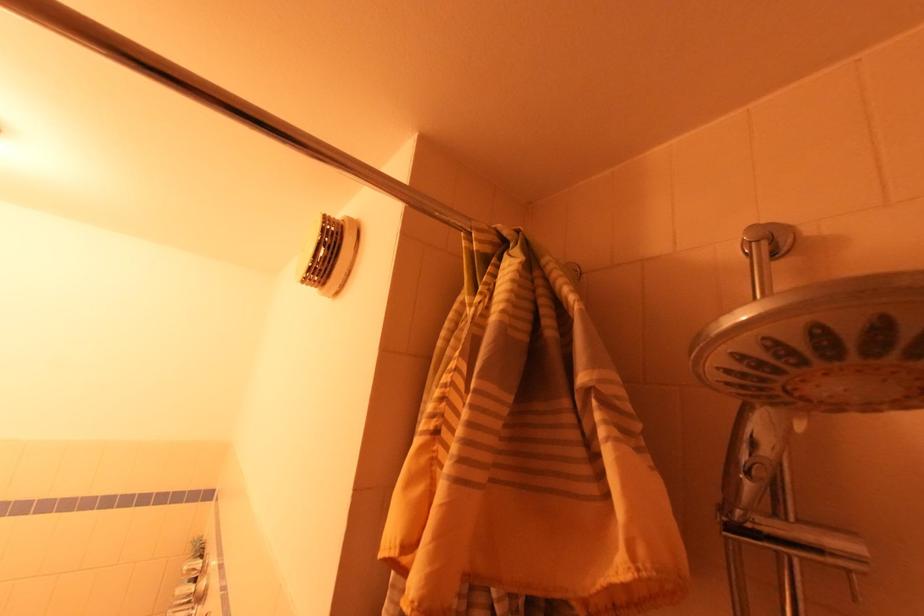
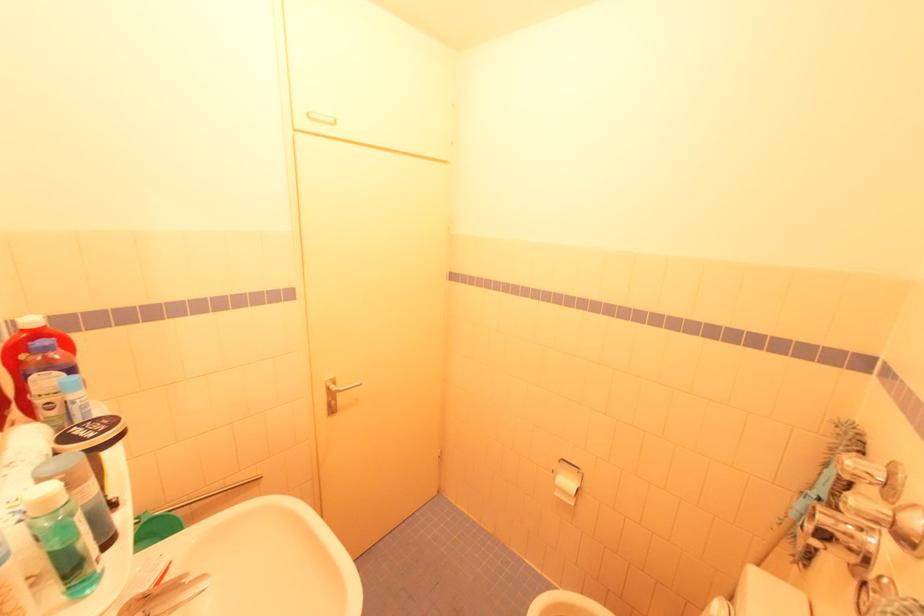
Question: How did the camera likely rotate?

Choices:
 (A) Left
 (B) Right
 (C) Up
 (D) Down

Answer: (A)